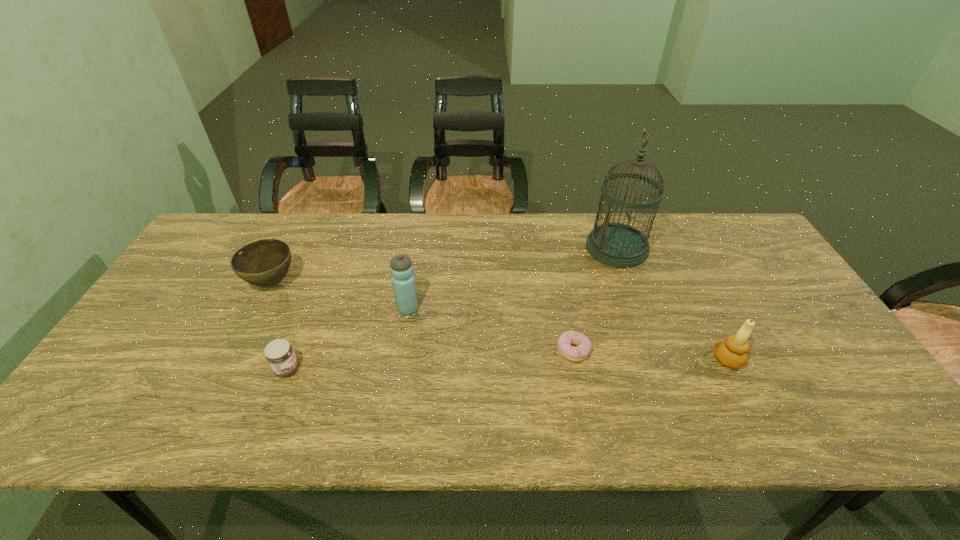
Find the location of a particular element. object located at the far edge is located at coordinates (618, 245).

Locate an element on the screen. vacant region at the far edge is located at coordinates (507, 229).

Locate an element on the screen. free region at the near edge is located at coordinates (282, 415).

Locate an element on the screen. This screenshot has width=960, height=540. vacant point at the right edge is located at coordinates (758, 262).

Locate an element on the screen. Image resolution: width=960 pixels, height=540 pixels. vacant space at the far left corner is located at coordinates (210, 230).

Identify the location of vacant space at the far right corner. (728, 224).

Locate an element on the screen. free space between the birdcage and the bowl is located at coordinates (444, 266).

Image resolution: width=960 pixels, height=540 pixels. In order to click on free space that is in between the fifth tallest object and the fourth object from right to left in this screenshot , I will do `click(348, 339)`.

In order to click on vacant area between the third object from left to right and the fifth tallest object in this screenshot , I will do `click(348, 339)`.

This screenshot has width=960, height=540. What are the coordinates of `free spot between the doughnut and the tallest object` in the screenshot? It's located at (595, 300).